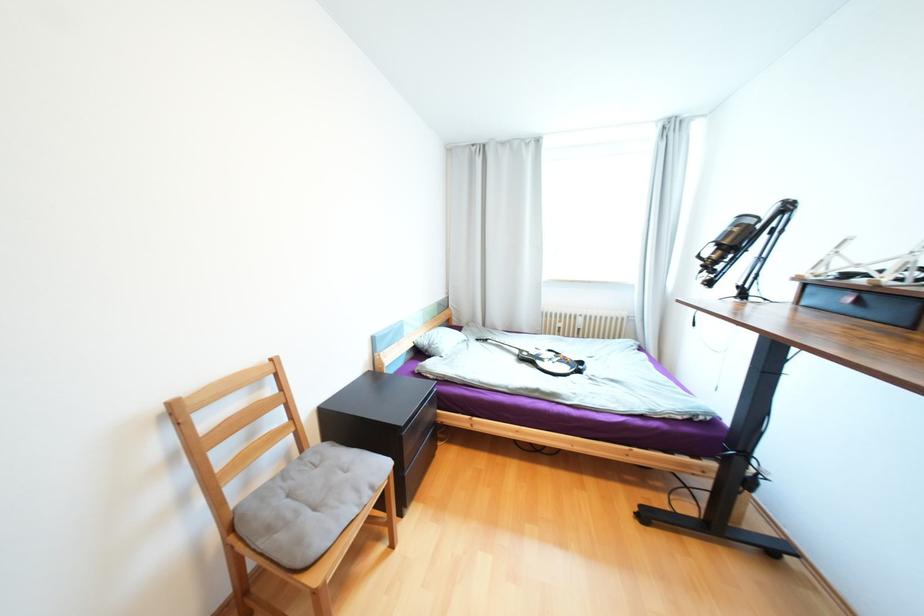
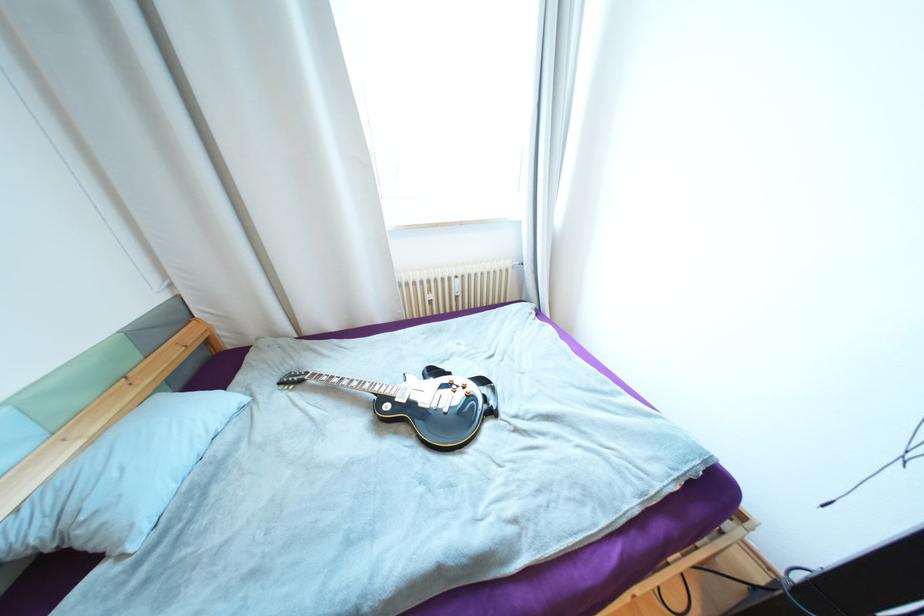
In the second image, find the point that corresponds to (x=585, y=330) in the first image.

(463, 297)